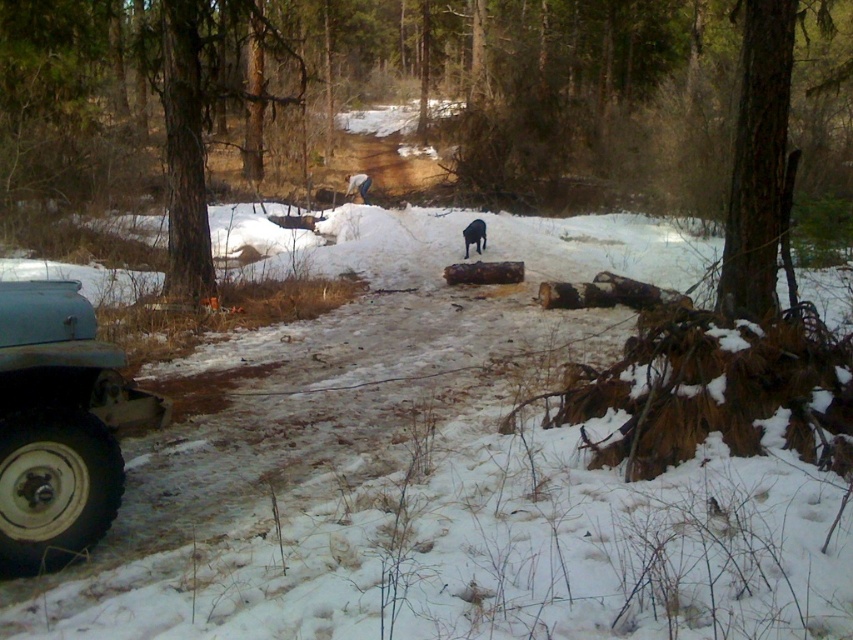
Can you confirm if rusty metal jeep at lower left is shorter than black fur dog at center?

No, rusty metal jeep at lower left is not shorter than black fur dog at center.

Is rusty metal jeep at lower left taller than black fur dog at center?

Yes.

What do you see at coordinates (59, 426) in the screenshot?
I see `rusty metal jeep at lower left` at bounding box center [59, 426].

This screenshot has height=640, width=853. I want to click on rusty metal jeep at lower left, so pyautogui.click(x=59, y=426).

Does black fur dog at center appear under shiny metallic dog at center?

Indeed, black fur dog at center is positioned under shiny metallic dog at center.

Is black fur dog at center in front of shiny metallic dog at center?

Yes.

What are the coordinates of `black fur dog at center` in the screenshot? It's located at pyautogui.click(x=474, y=236).

Is rusty metal jeep at lower left bigger than brown rough tree at upper right?

Actually, rusty metal jeep at lower left might be smaller than brown rough tree at upper right.

Does rusty metal jeep at lower left appear on the right side of brown rough tree at upper right?

Incorrect, rusty metal jeep at lower left is not on the right side of brown rough tree at upper right.

This screenshot has width=853, height=640. Describe the element at coordinates (59, 426) in the screenshot. I see `rusty metal jeep at lower left` at that location.

You are a GUI agent. You are given a task and a screenshot of the screen. Output one action in this format:
    pyautogui.click(x=<x>, y=<y>)
    Task: Click on the rusty metal jeep at lower left
    This screenshot has width=853, height=640.
    Given the screenshot: What is the action you would take?
    pyautogui.click(x=59, y=426)